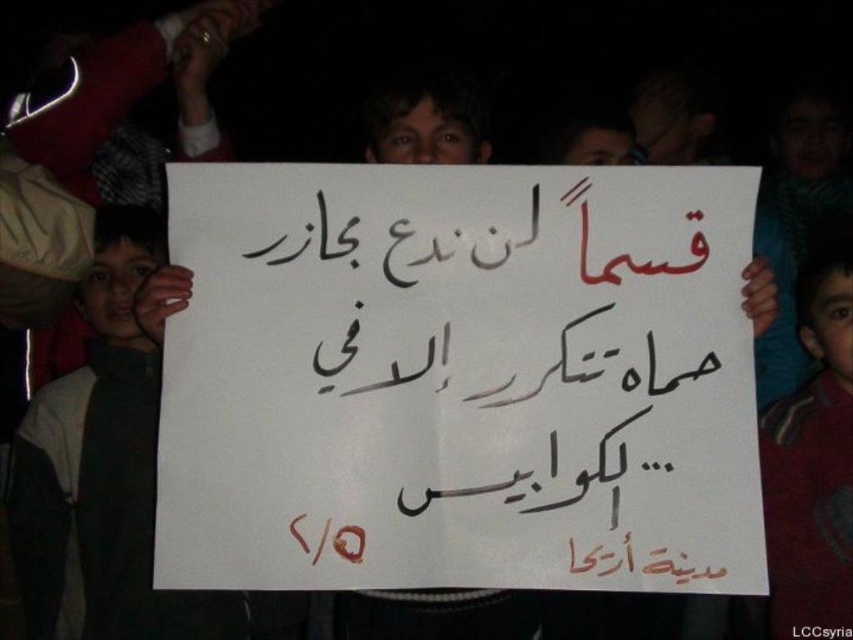
Question: Does white paper sign at center appear over maroon fabric shirt at right?

Choices:
 (A) yes
 (B) no

Answer: (A)

Question: Can you confirm if white paper sign at center is positioned below maroon fabric shirt at right?

Choices:
 (A) yes
 (B) no

Answer: (B)

Question: Which point appears closest to the camera in this image?

Choices:
 (A) (849, 465)
 (B) (161, 534)

Answer: (B)

Question: Is white paper sign at center smaller than maroon fabric shirt at right?

Choices:
 (A) yes
 (B) no

Answer: (A)

Question: Which object appears farthest from the camera in this image?

Choices:
 (A) white paper sign at center
 (B) maroon fabric shirt at right

Answer: (B)

Question: Among these points, which one is farthest from the camera?

Choices:
 (A) (840, 266)
 (B) (506, 164)

Answer: (A)